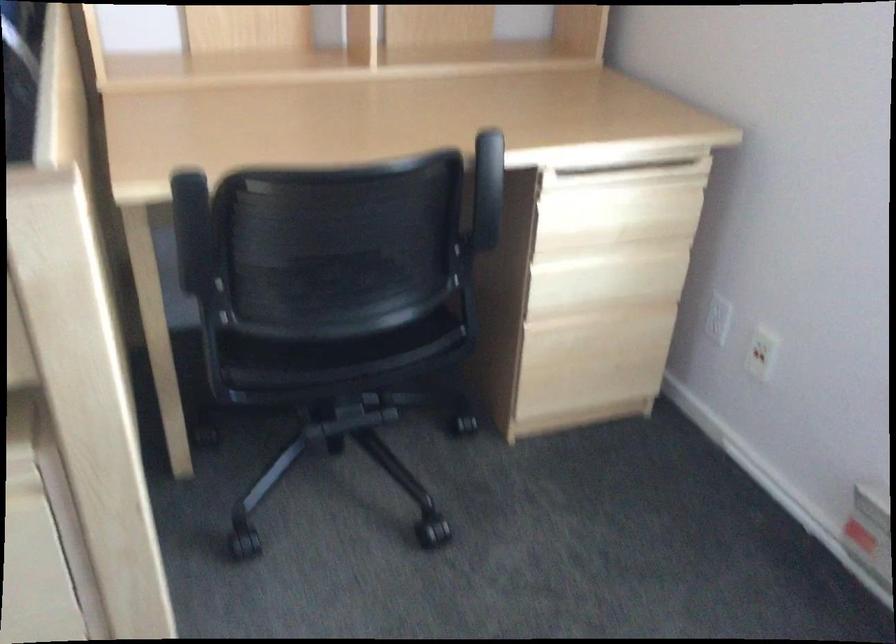
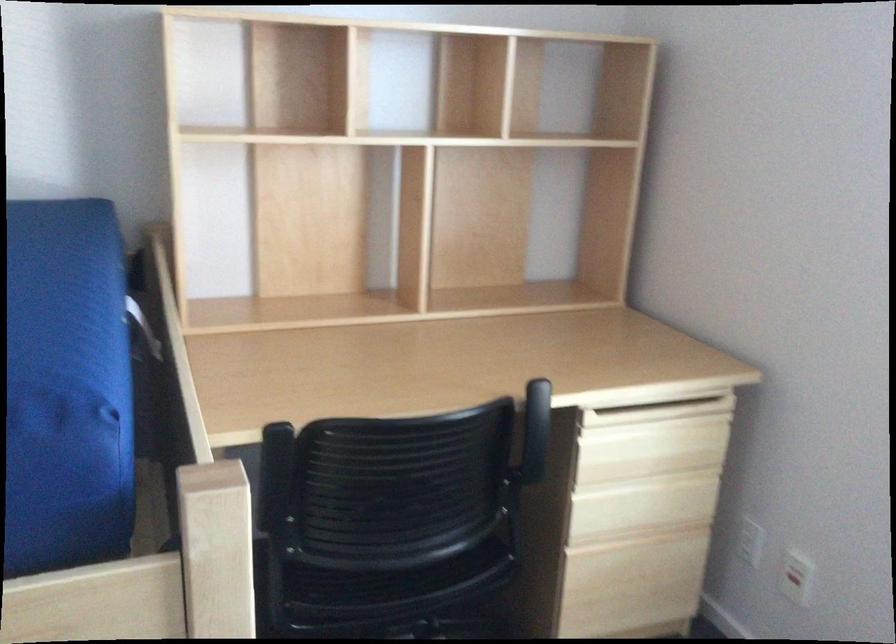
The point at (x=487, y=176) is marked in the first image. Where is the corresponding point in the second image?

(536, 417)